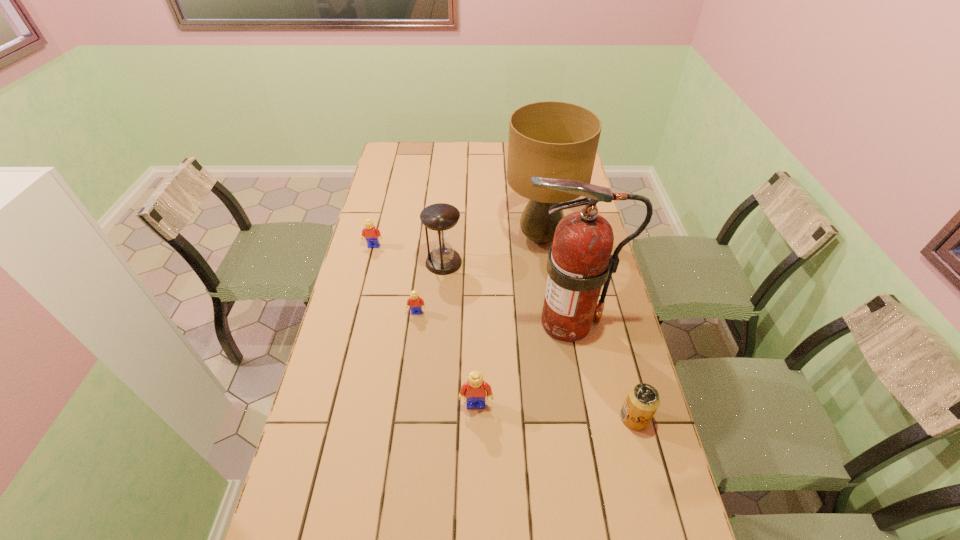
This screenshot has width=960, height=540. Find the location of `free point that keeps the Legos evenly spaced on the right`. free point that keeps the Legos evenly spaced on the right is located at coordinates (563, 536).